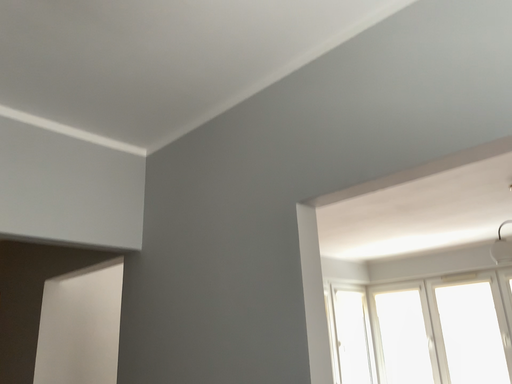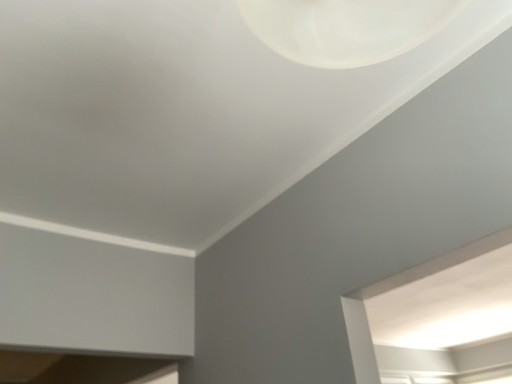
Question: How did the camera likely rotate when shooting the video?

Choices:
 (A) rotated upward
 (B) rotated downward

Answer: (A)